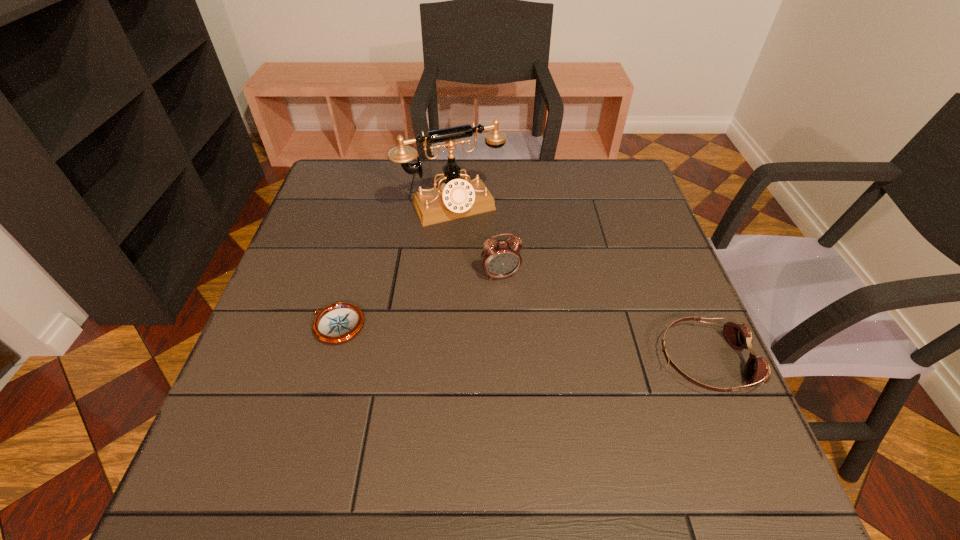
Locate an element on the screen. vacant area that satisfies the following two spatial constraints: 1. on the front side of the second tallest object; 2. on the left side of the farthest object is located at coordinates (446, 275).

Where is `vacant position in the image that satisfies the following two spatial constraints: 1. on the front side of the rightmost object; 2. through the lenses of the farthest object`? vacant position in the image that satisfies the following two spatial constraints: 1. on the front side of the rightmost object; 2. through the lenses of the farthest object is located at coordinates 441,361.